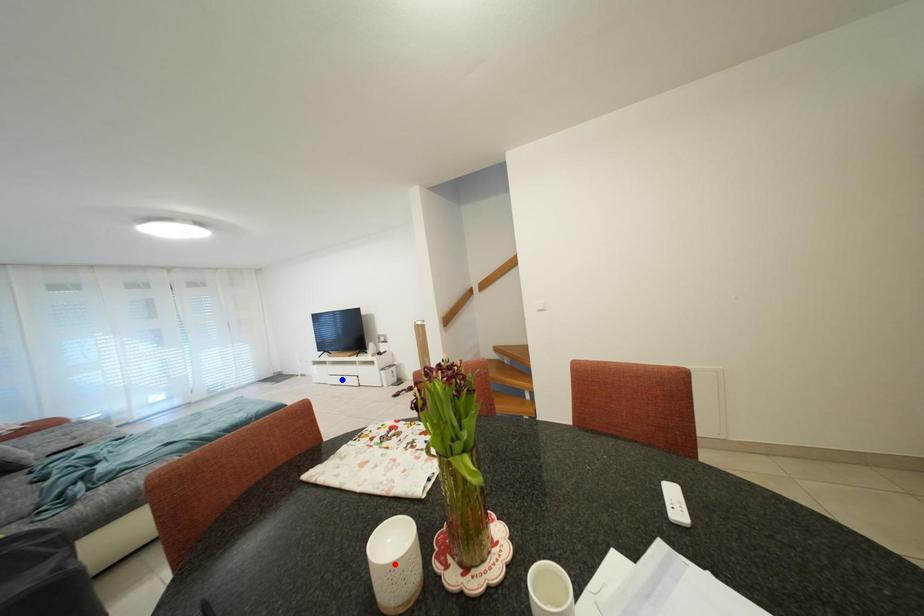
Question: In the image, two points are highlighted. Which point is nearer to the camera? Reply with the corresponding letter.

Choices:
 (A) blue point
 (B) red point

Answer: (B)